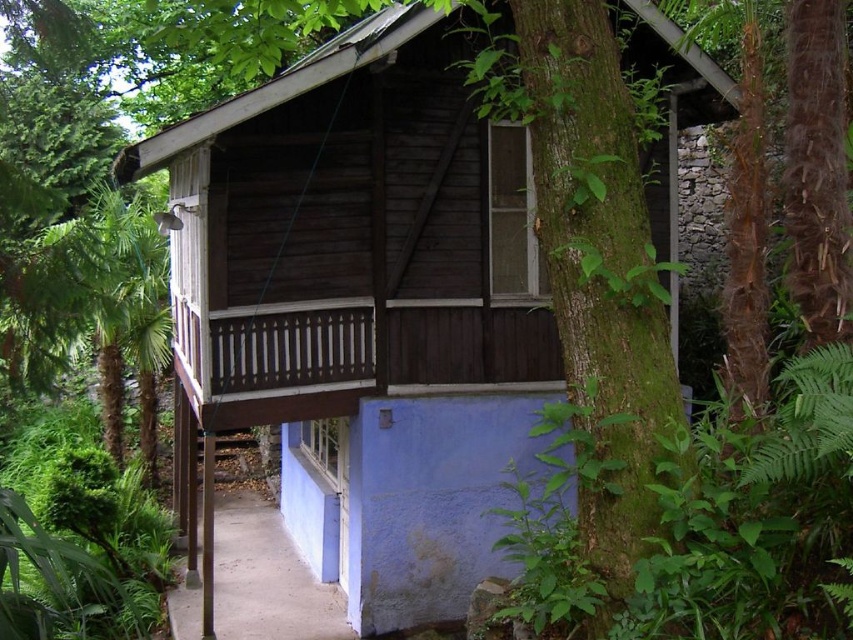
Question: Which is farther from the wooden cabin at center?

Choices:
 (A) brown concrete path at lower center
 (B) green leafy tree at left

Answer: (A)

Question: Is wooden cabin at center wider than green leafy tree at left?

Choices:
 (A) no
 (B) yes

Answer: (A)

Question: Is wooden cabin at center wider than brown concrete path at lower center?

Choices:
 (A) yes
 (B) no

Answer: (A)

Question: Estimate the real-world distances between objects in this image. Which object is farther from the green leafy tree at left?

Choices:
 (A) wooden cabin at center
 (B) brown concrete path at lower center

Answer: (B)

Question: Based on their relative distances, which object is nearer to the wooden cabin at center?

Choices:
 (A) brown concrete path at lower center
 (B) green leafy tree at left

Answer: (B)

Question: Is the position of wooden cabin at center more distant than that of green leafy tree at left?

Choices:
 (A) yes
 (B) no

Answer: (A)